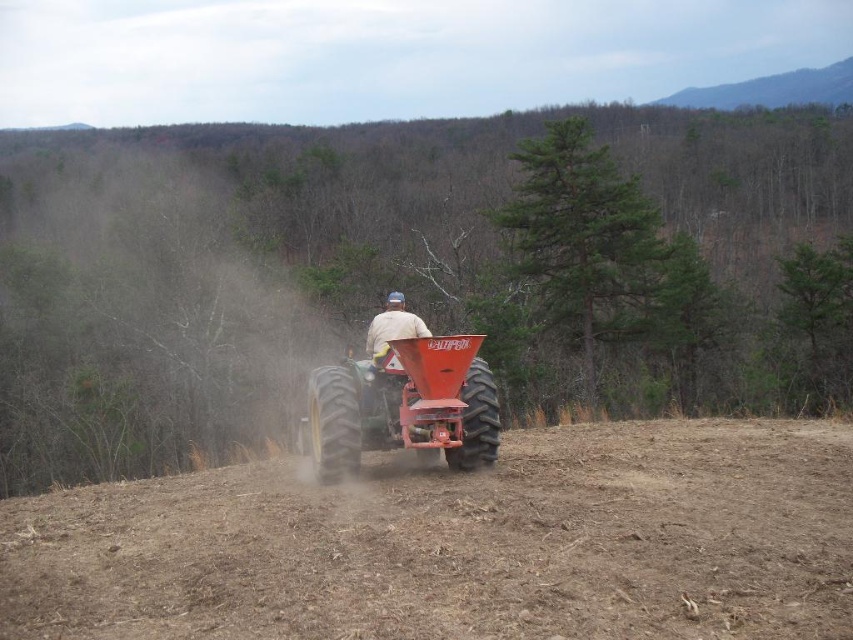
Question: Which point is closer to the camera?

Choices:
 (A) (473, 504)
 (B) (370, 352)

Answer: (A)

Question: Is brown soil at center smaller than white matte shirt at center?

Choices:
 (A) no
 (B) yes

Answer: (B)

Question: Which point appears farthest from the camera in this image?

Choices:
 (A) click(x=373, y=332)
 (B) click(x=376, y=417)

Answer: (A)

Question: Which point is closer to the camera taking this photo?

Choices:
 (A) (376, 314)
 (B) (424, 403)

Answer: (B)

Question: In this image, where is brown soil at center located relative to green rubber tractor at center?

Choices:
 (A) below
 (B) above

Answer: (A)

Question: Does brown soil at center have a smaller size compared to white matte shirt at center?

Choices:
 (A) no
 (B) yes

Answer: (B)